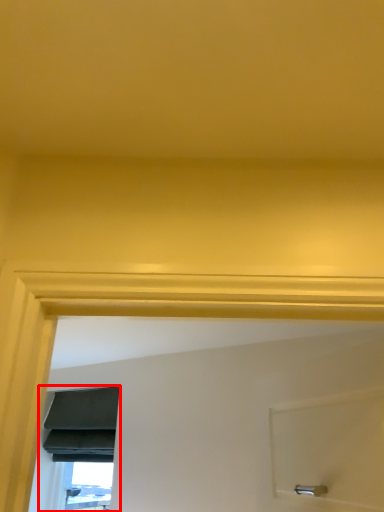
Question: Considering the relative positions of window (annotated by the red box) and window in the image provided, where is window (annotated by the red box) located with respect to the staircase?

Choices:
 (A) right
 (B) left

Answer: (B)